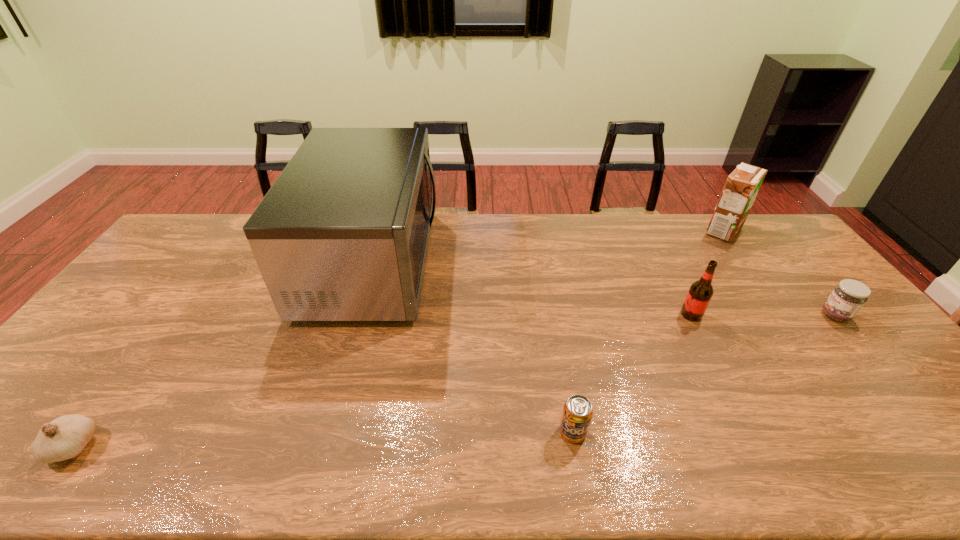
Locate an element on the screen. This screenshot has height=540, width=960. microwave oven is located at coordinates (342, 235).

Find the location of `the tallest object`. the tallest object is located at coordinates (342, 235).

Find the location of a particular element. The image size is (960, 540). the fifth shortest object is located at coordinates (742, 186).

Where is `carton`? This screenshot has width=960, height=540. carton is located at coordinates (742, 186).

Find the location of a particular element. Image resolution: width=960 pixels, height=540 pixels. the third object from right to left is located at coordinates (700, 293).

Locate an element on the screen. The image size is (960, 540). root beer is located at coordinates (700, 293).

The width and height of the screenshot is (960, 540). Identify the location of the rightmost object. (848, 297).

Identify the location of the fourth object from right to left. (577, 413).

Where is `the leftmost object`? This screenshot has width=960, height=540. the leftmost object is located at coordinates (65, 437).

Image resolution: width=960 pixels, height=540 pixels. I want to click on free space located on the front-facing side of the fifth object from right to left, so click(536, 262).